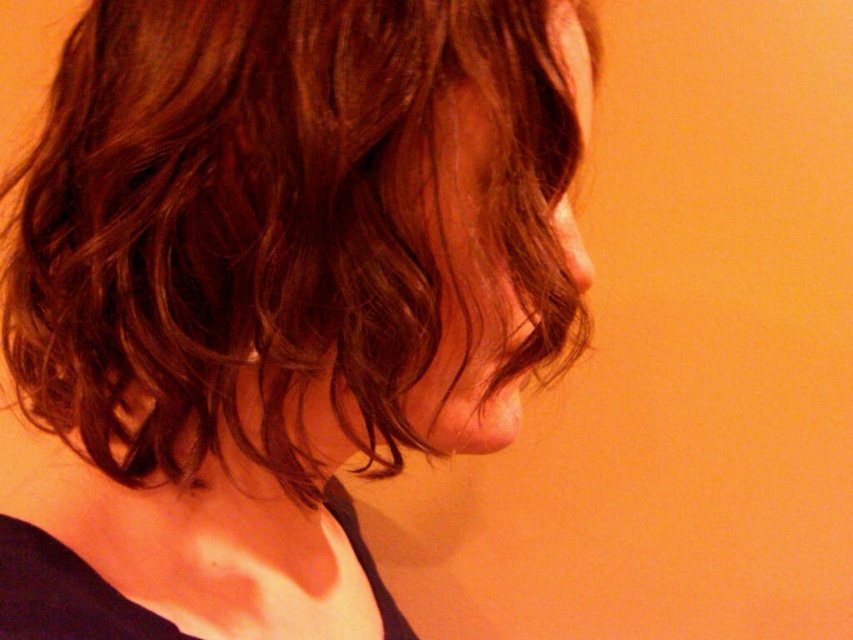
Based on the photo, does brown wavy hair at center appear on the left side of shiny brown hair at center?

Indeed, brown wavy hair at center is positioned on the left side of shiny brown hair at center.

Between point (170, 529) and point (529, 362), which one is positioned behind?

The point (170, 529) is more distant.

Find the location of a particular element. brown wavy hair at center is located at coordinates (276, 296).